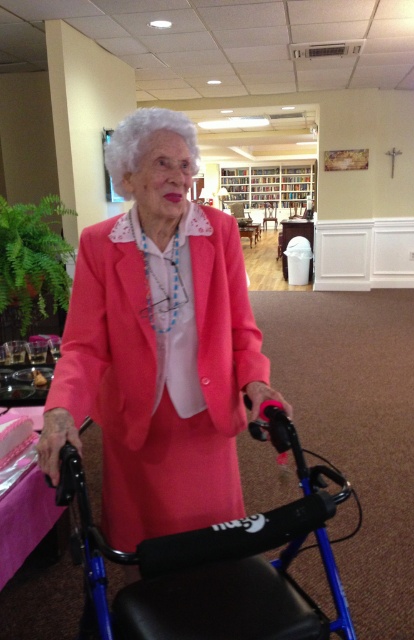
Question: Based on their relative distances, which object is farther from the blue plastic walker at center?

Choices:
 (A) pink matte jacket at center
 (B) wooden bookshelf at upper center

Answer: (B)

Question: In this image, where is pink matte jacket at center located relative to wooden bookshelf at upper center?

Choices:
 (A) below
 (B) above

Answer: (A)

Question: Is pink matte jacket at center positioned behind wooden bookshelf at upper center?

Choices:
 (A) yes
 (B) no

Answer: (B)

Question: Which of the following is the farthest from the observer?

Choices:
 (A) (134, 424)
 (B) (228, 170)
 (C) (243, 618)

Answer: (B)

Question: Which point is closer to the camera taking this photo?

Choices:
 (A) (313, 172)
 (B) (175, 596)
 (C) (67, 321)

Answer: (B)

Question: Observing the image, what is the correct spatial positioning of pink matte jacket at center in reference to blue plastic walker at center?

Choices:
 (A) above
 (B) below

Answer: (A)